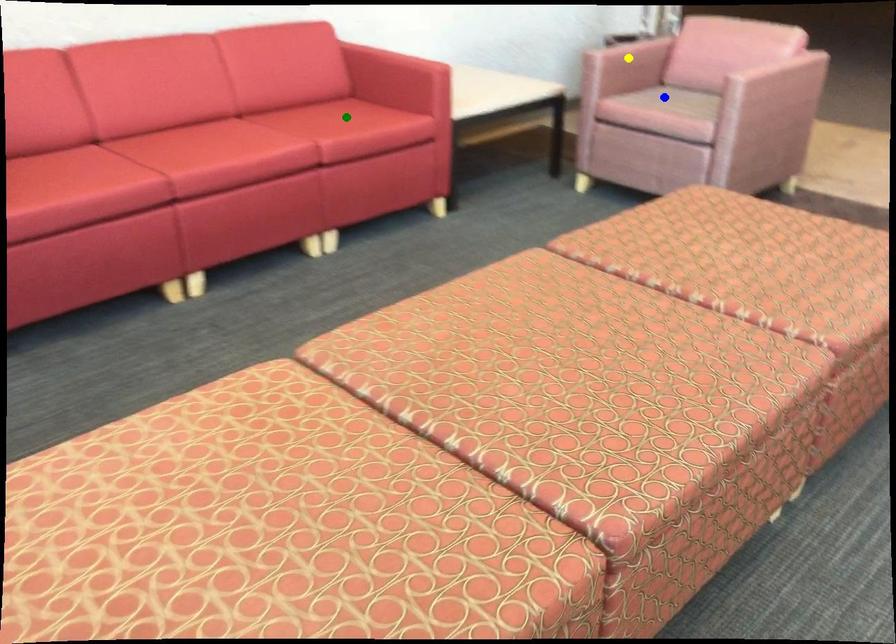
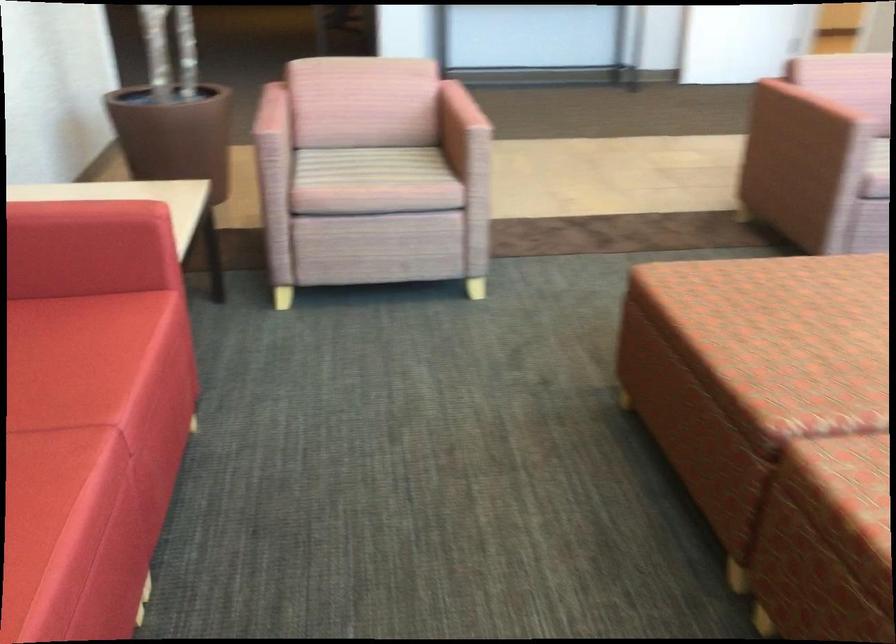
I am providing you with two images of the same scene from different viewpoints. Three points are marked in image1. Which point corresponds to a part or object that is occluded in image2?In image1, three points are marked. Which of them correspond to a part or object that is occluded in image2?Among the three points shown in image1, which one corresponds to a part or object that is no longer visible due to occlusion in image2?

Invisible in image2: yellow point.